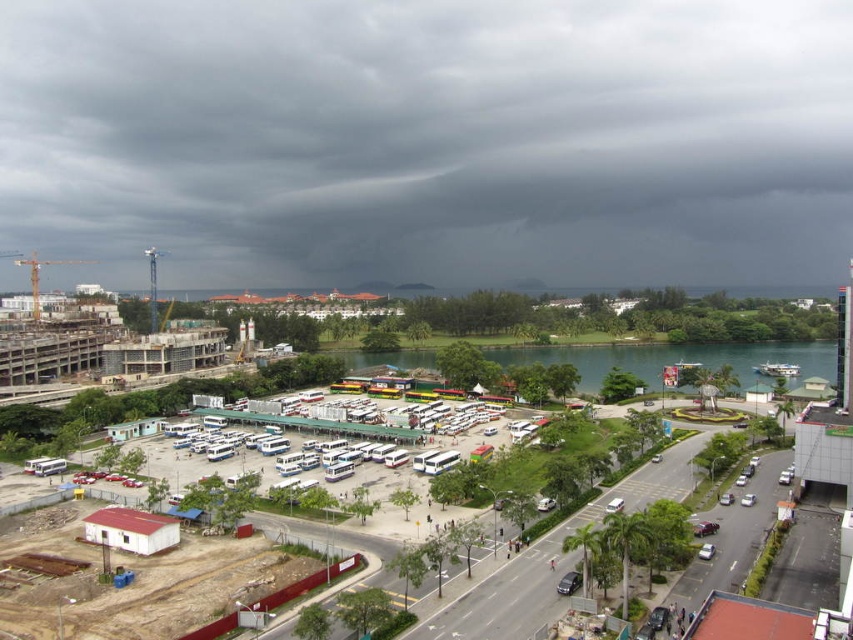
You are a drone operator trying to capture a photo of the concrete construction site at center from the dark gray cloud at upper center. Given that your drone can only fly up to 200 meters, will you be able to reach the construction site from the cloud?

The dark gray cloud at upper center is 195.07 meters from concrete construction site at center, so yes, the drone can reach the construction site as the distance is within its 200 meters range.

You are a city planner reviewing this area. You need to determine the spatial relationship between the dark gray cloud at upper center and the concrete construction site at center. Which object is located to the left of the other?

The dark gray cloud at upper center is to the left of the concrete construction site at center according to the description provided.

You are standing at the construction site on the left and want to reach the parking lot. There are two points marked on your map as point 1 at coordinates point (357, 58) and point 2 at coordinates point (648, 371). Which point is closer to you?

Point (357, 58) is closer to you because it is further to the viewer than point (648, 371).